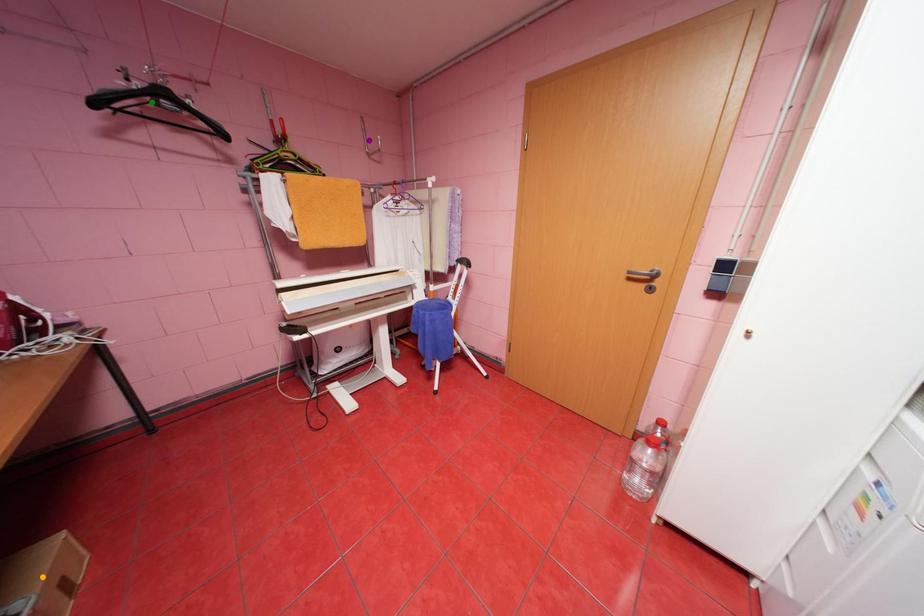
Order these from nearest to farthest:
green point
purple point
orange point

orange point < green point < purple point